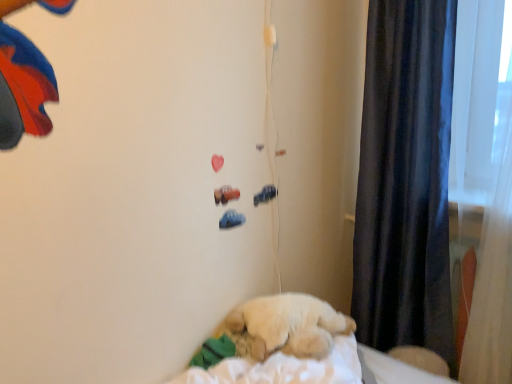
Question: Is fluffy beige dog at center to the right of dark blue velvet curtain at right from the viewer's perspective?

Choices:
 (A) yes
 (B) no

Answer: (B)

Question: Considering the relative sizes of fluffy beige dog at center and dark blue velvet curtain at right in the image provided, is fluffy beige dog at center taller than dark blue velvet curtain at right?

Choices:
 (A) no
 (B) yes

Answer: (A)

Question: Is fluffy beige dog at center positioned behind dark blue velvet curtain at right?

Choices:
 (A) yes
 (B) no

Answer: (B)

Question: Is fluffy beige dog at center not close to dark blue velvet curtain at right?

Choices:
 (A) yes
 (B) no

Answer: (B)

Question: Is dark blue velvet curtain at right located within fluffy beige dog at center?

Choices:
 (A) yes
 (B) no

Answer: (B)

Question: Considering the relative sizes of fluffy beige dog at center and dark blue velvet curtain at right in the image provided, is fluffy beige dog at center wider than dark blue velvet curtain at right?

Choices:
 (A) no
 (B) yes

Answer: (B)

Question: From a real-world perspective, is white soft sheet at lower right physically above fluffy beige dog at center?

Choices:
 (A) no
 (B) yes

Answer: (A)

Question: Does white soft sheet at lower right turn towards fluffy beige dog at center?

Choices:
 (A) yes
 (B) no

Answer: (B)

Question: Is white soft sheet at lower right wider than fluffy beige dog at center?

Choices:
 (A) yes
 (B) no

Answer: (B)

Question: Is the position of white soft sheet at lower right less distant than that of fluffy beige dog at center?

Choices:
 (A) no
 (B) yes

Answer: (A)

Question: Is white soft sheet at lower right placed right next to fluffy beige dog at center?

Choices:
 (A) no
 (B) yes

Answer: (A)

Question: Can fluffy beige dog at center be found inside white soft sheet at lower right?

Choices:
 (A) yes
 (B) no

Answer: (B)

Question: Can you confirm if white soft sheet at lower right is shorter than dark blue velvet curtain at right?

Choices:
 (A) no
 (B) yes

Answer: (B)